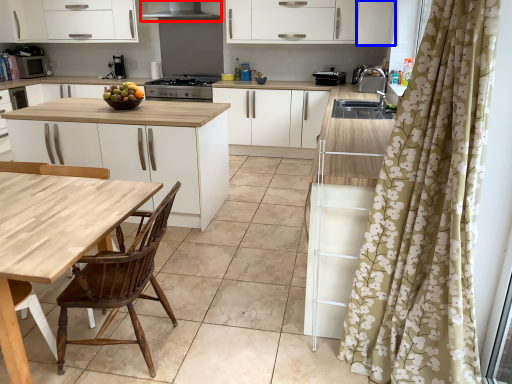
Question: Which of the following is the farthest to the observer, exhaust hood (highlighted by a red box) or cabinetry (highlighted by a blue box)?

Choices:
 (A) exhaust hood
 (B) cabinetry

Answer: (A)